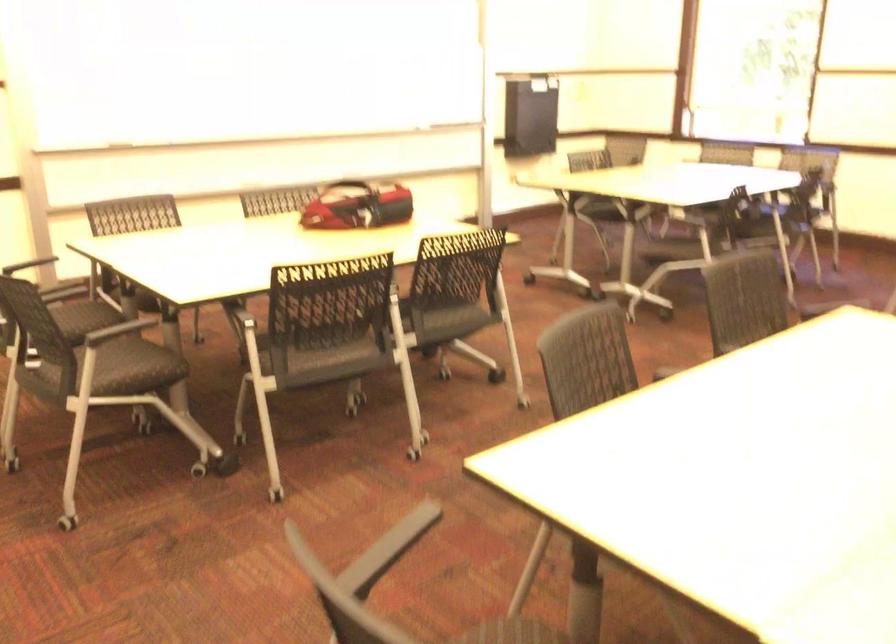
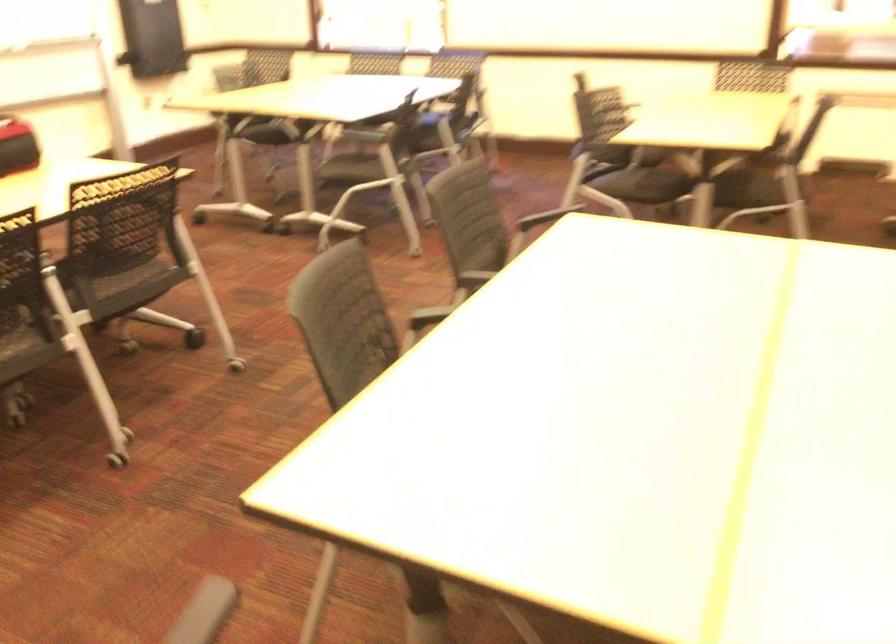
Question: The camera is either moving clockwise (left) or counter-clockwise (right) around the object. The first image is from the beginning of the video and the second image is from the end. Is the camera moving left or right when shooting the video?

Choices:
 (A) Left
 (B) Right

Answer: (A)